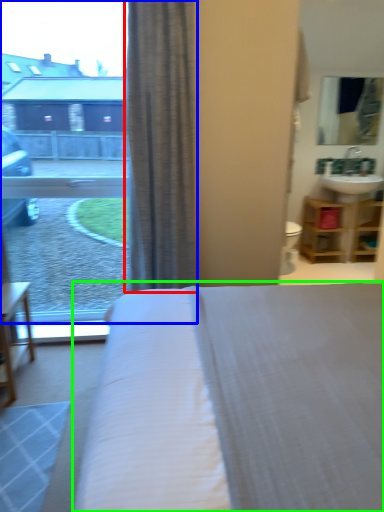
Question: Which object is the closest to the curtain (highlighted by a red box)? Choose among these: window (highlighted by a blue box) or bed (highlighted by a green box).

Choices:
 (A) window
 (B) bed

Answer: (B)